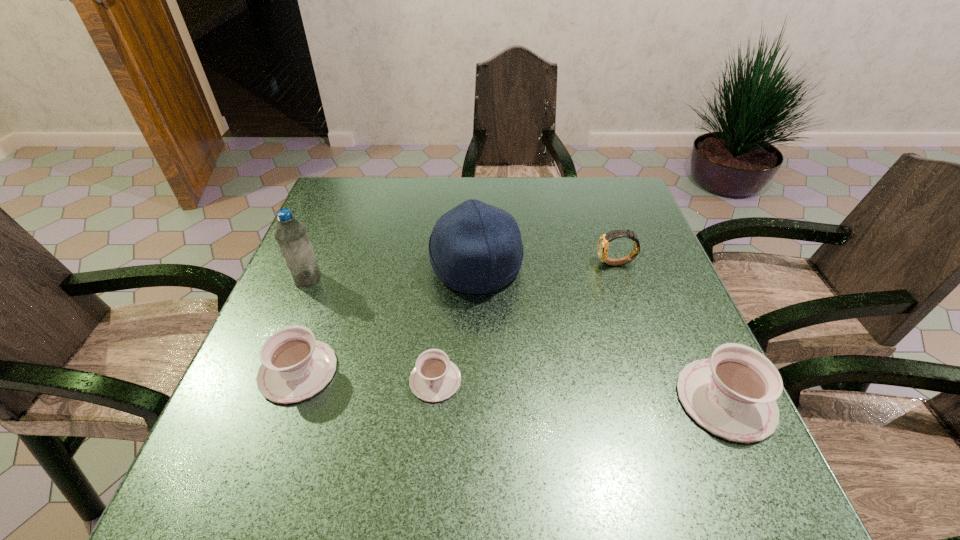
The height and width of the screenshot is (540, 960). I want to click on the leftmost teacup, so click(x=295, y=366).

Where is `the fifth tallest object`? The width and height of the screenshot is (960, 540). the fifth tallest object is located at coordinates (295, 366).

The height and width of the screenshot is (540, 960). I want to click on the shortest teacup, so click(435, 378).

The height and width of the screenshot is (540, 960). I want to click on the shortest object, so click(435, 378).

Where is `the rightmost teacup`? This screenshot has width=960, height=540. the rightmost teacup is located at coordinates (733, 395).

This screenshot has height=540, width=960. I want to click on water bottle, so click(x=291, y=235).

Where is `skullcap`? The width and height of the screenshot is (960, 540). skullcap is located at coordinates (475, 248).

Find the location of a particular element. The height and width of the screenshot is (540, 960). watch is located at coordinates (603, 243).

What are the coordinates of `vacant region located on the handle side of the fifth tallest object` in the screenshot? It's located at (349, 229).

I want to click on vacant space situated on the handle side of the fifth tallest object, so click(324, 296).